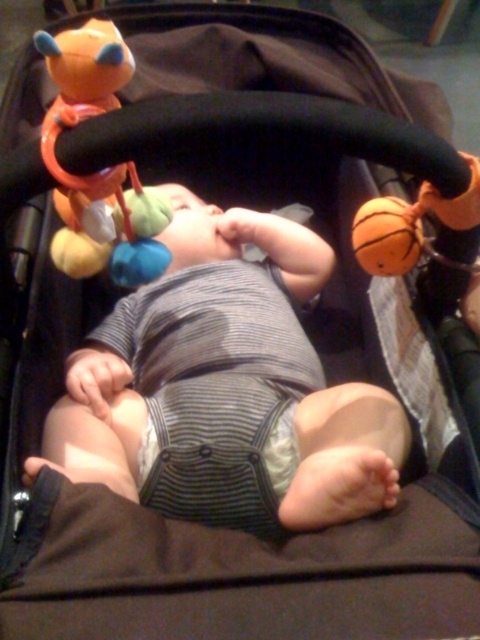
You are a parent holding a baby bottle and standing 30 inches away from the striped fabric baby at center. Can you reach the baby to feed it without moving closer?

The distance between the striped fabric baby at center and the viewer is 28.03 inches, so since you are standing 30 inches away, you are slightly farther than the measured distance. Therefore, you may need to move a little closer to comfortably reach the baby with the bottle.

You are a parent checking if your baby in the striped fabric baby at center can reach the matte orange plush toy at upper left. Based on their sizes, can the baby grab the toy?

The striped fabric baby at center is bigger than the matte orange plush toy at upper left, so the baby should be able to reach and grab the toy.